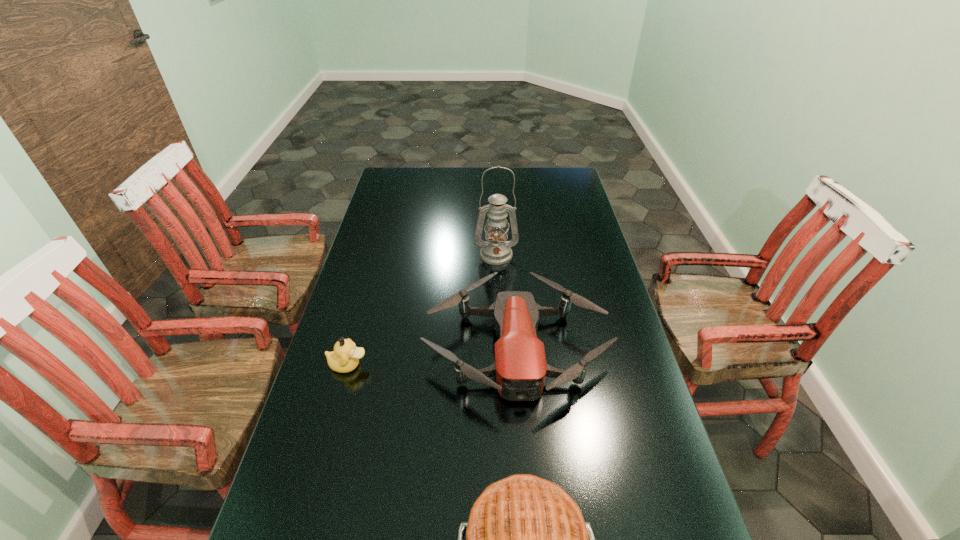
This screenshot has width=960, height=540. I want to click on object that is the second closest to the pie, so click(x=345, y=358).

The image size is (960, 540). Identify the location of free space that satisfies the following two spatial constraints: 1. on the front-facing side of the drone; 2. on the face of the leftmost object. (517, 365).

Locate an element on the screen. This screenshot has width=960, height=540. free spot that satisfies the following two spatial constraints: 1. on the front side of the farthest object; 2. on the face of the duckling is located at coordinates (501, 365).

Identify the location of vacant region that satisfies the following two spatial constraints: 1. on the front side of the oil lamp; 2. on the face of the duckling. The image size is (960, 540). (501, 365).

This screenshot has width=960, height=540. I want to click on vacant space that satisfies the following two spatial constraints: 1. on the front-facing side of the drone; 2. on the face of the duckling, so click(x=517, y=365).

Find the location of a particular element. free space that satisfies the following two spatial constraints: 1. on the front-facing side of the drone; 2. on the face of the leftmost object is located at coordinates (517, 365).

Find the location of a particular element. The height and width of the screenshot is (540, 960). free space that satisfies the following two spatial constraints: 1. on the front-facing side of the drone; 2. on the face of the duckling is located at coordinates (517, 365).